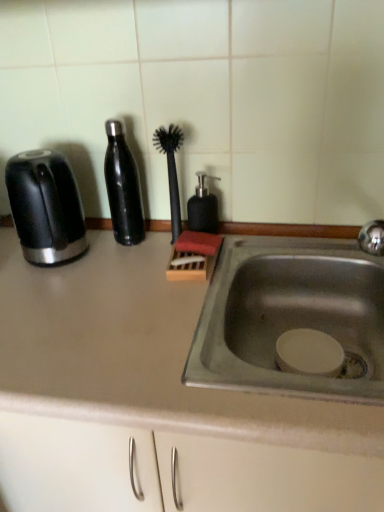
In order to click on free space in front of black rubber brush at center in this screenshot , I will do `click(157, 287)`.